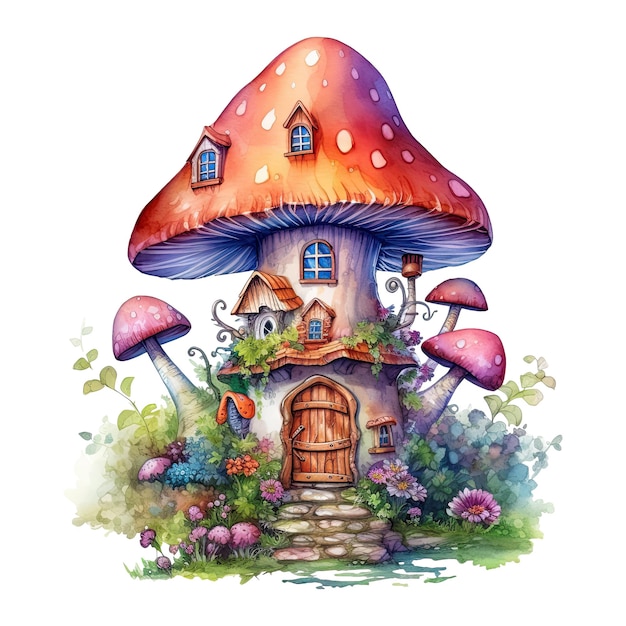
This screenshot has width=626, height=626. In order to click on door in this screenshot , I will do `click(315, 434)`.